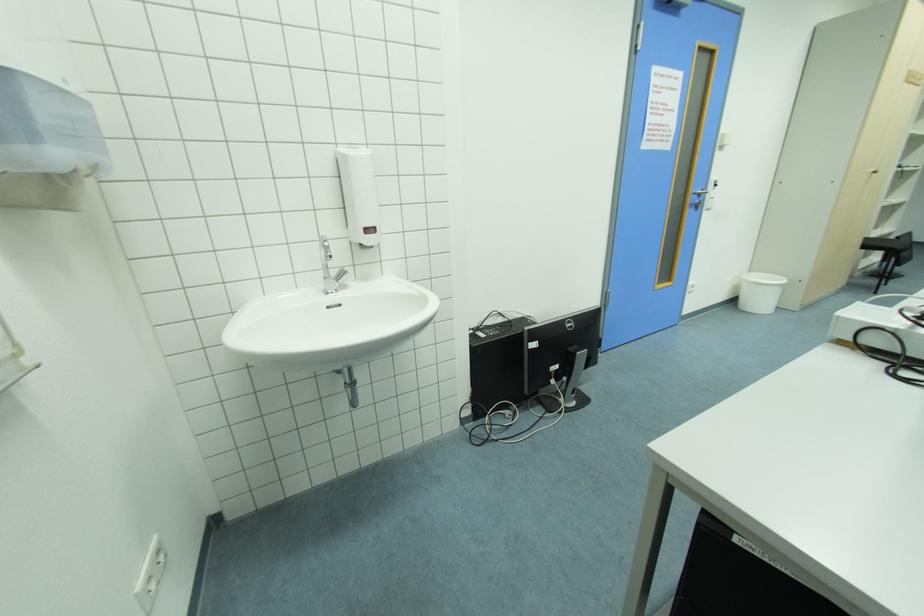
Find where to pull the cabinet door handle. Please return your answer as a coordinate pair (x, y).

(873, 172)